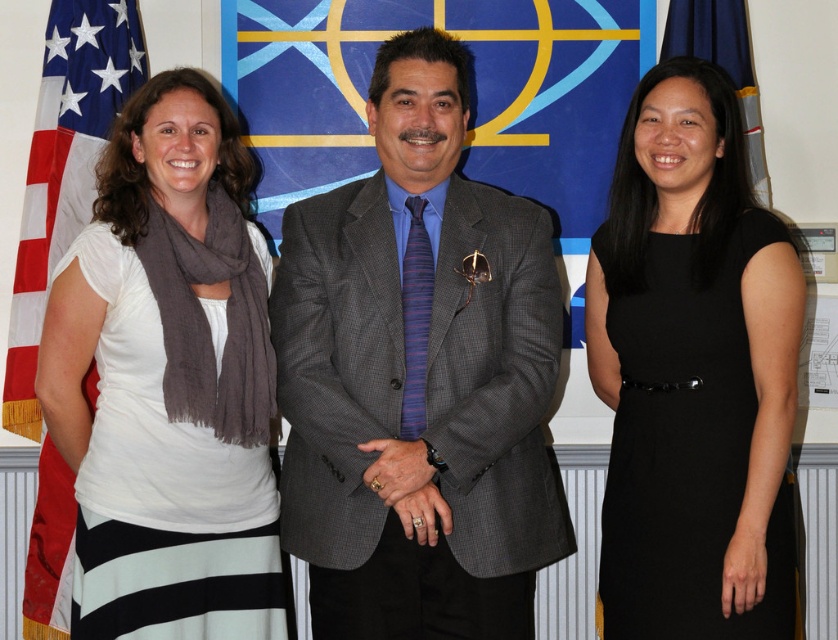
Question: Does gray textured suit at center have a smaller size compared to white cotton scarf at left?

Choices:
 (A) no
 (B) yes

Answer: (A)

Question: Which object is closer to the camera taking this photo?

Choices:
 (A) red fabric flag at left
 (B) black satin dress at right

Answer: (B)

Question: Which is farther from the white cotton scarf at left?

Choices:
 (A) black satin dress at right
 (B) gray textured suit at center
 (C) blue fabric flag at upper right
 (D) red fabric flag at left

Answer: (C)

Question: Estimate the real-world distances between objects in this image. Which object is farther from the black satin dress at right?

Choices:
 (A) white cotton scarf at left
 (B) blue fabric flag at upper right
 (C) gray textured suit at center
 (D) red fabric flag at left

Answer: (D)

Question: Can you confirm if black satin dress at right is positioned above blue fabric flag at upper right?

Choices:
 (A) yes
 (B) no

Answer: (B)

Question: Can you confirm if black satin dress at right is positioned above blue fabric flag at upper right?

Choices:
 (A) no
 (B) yes

Answer: (A)